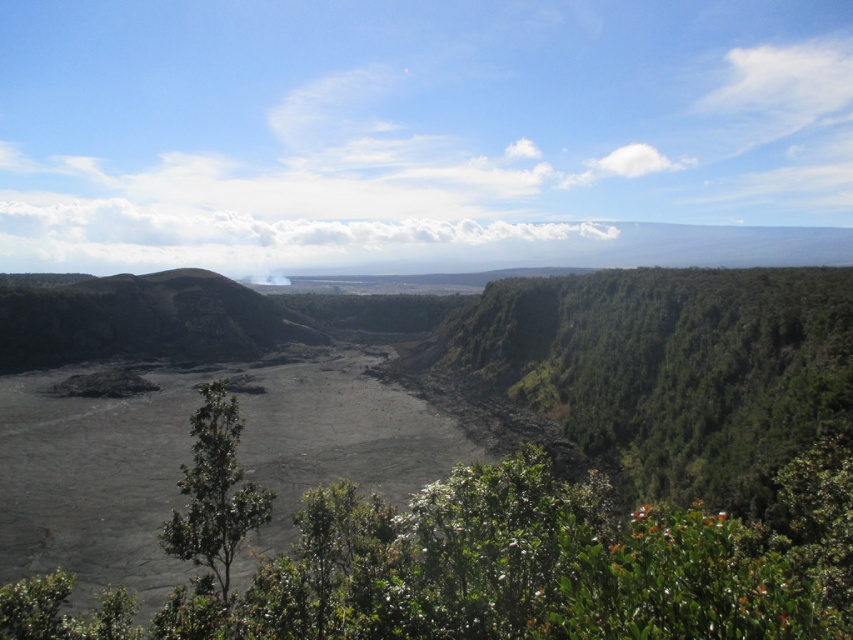
Question: Does green leafy shrubs at center have a larger size compared to volcanic rock mountain at left?

Choices:
 (A) yes
 (B) no

Answer: (B)

Question: Can you confirm if green leafy shrubs at center is thinner than green leafy tree at center?

Choices:
 (A) no
 (B) yes

Answer: (A)

Question: Where is volcanic rock mountain at left located in relation to green leafy tree at center in the image?

Choices:
 (A) right
 (B) left

Answer: (B)

Question: Considering the real-world distances, which object is closest to the volcanic rock mountain at left?

Choices:
 (A) green leafy shrubs at center
 (B) white smoke at center
 (C) green leafy tree at center

Answer: (C)

Question: Estimate the real-world distances between objects in this image. Which object is farther from the green leafy shrubs at center?

Choices:
 (A) volcanic rock mountain at left
 (B) white smoke at center

Answer: (B)

Question: Which object is positioned farthest from the white smoke at center?

Choices:
 (A) green leafy shrubs at center
 (B) volcanic rock mountain at left
 (C) green leafy tree at center

Answer: (A)